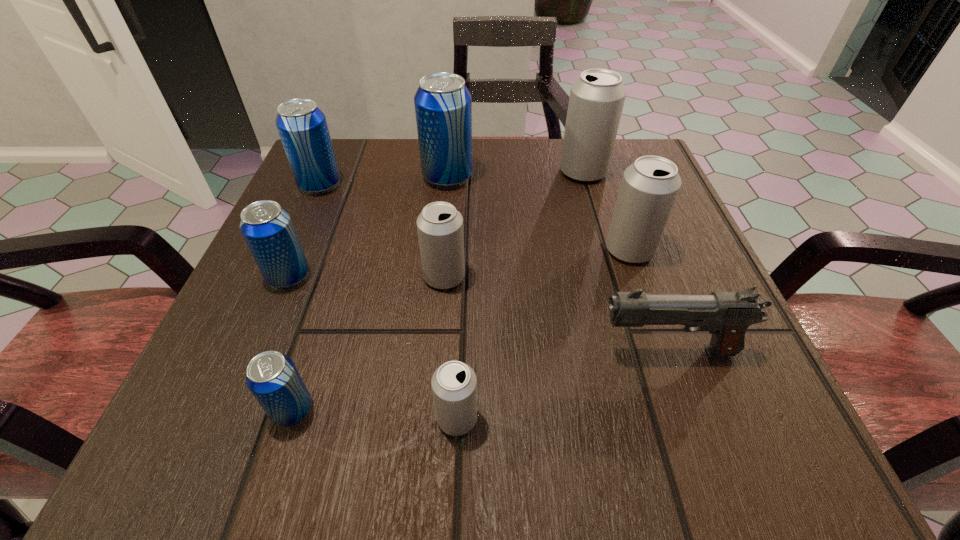
This screenshot has width=960, height=540. In order to click on object that is the seventh closest one to the smallest white beer can in this screenshot , I will do `click(302, 126)`.

Identify which object is the eighth nearest to the third farthest blue beer can. Please provide its 2D coordinates. Your answer should be formatted as a tuple, i.e. [(x, y)], where the tuple contains the x and y coordinates of a point satisfying the conditions above.

[(597, 97)]

The height and width of the screenshot is (540, 960). Find the location of `beer can that is the second closest to the third biggest blue beer can`. beer can that is the second closest to the third biggest blue beer can is located at coordinates (302, 126).

Where is `beer can that stands as the third closest to the nearest white beer can`? The image size is (960, 540). beer can that stands as the third closest to the nearest white beer can is located at coordinates (267, 228).

Image resolution: width=960 pixels, height=540 pixels. What are the coordinates of `blue beer can that is the fourth nearest to the second biggest white beer can` in the screenshot? It's located at (302, 126).

Identify which blue beer can is the second closest to the smallest white beer can. Please provide its 2D coordinates. Your answer should be formatted as a tuple, i.e. [(x, y)], where the tuple contains the x and y coordinates of a point satisfying the conditions above.

[(267, 228)]

Identify which white beer can is located as the second nearest to the third biggest white beer can. Please provide its 2D coordinates. Your answer should be formatted as a tuple, i.e. [(x, y)], where the tuple contains the x and y coordinates of a point satisfying the conditions above.

[(649, 187)]

The height and width of the screenshot is (540, 960). Find the location of `the second closest white beer can to the biggest white beer can`. the second closest white beer can to the biggest white beer can is located at coordinates (440, 226).

Locate an element on the screen. The width and height of the screenshot is (960, 540). vacant space that satisfies the following two spatial constraints: 1. on the front side of the biggest blue beer can; 2. on the left side of the third smallest white beer can is located at coordinates (441, 249).

Where is `free space that satisfies the following two spatial constraints: 1. on the front side of the nearest white beer can; 2. on the right side of the sixth beer can from right to left`? The width and height of the screenshot is (960, 540). free space that satisfies the following two spatial constraints: 1. on the front side of the nearest white beer can; 2. on the right side of the sixth beer can from right to left is located at coordinates (290, 418).